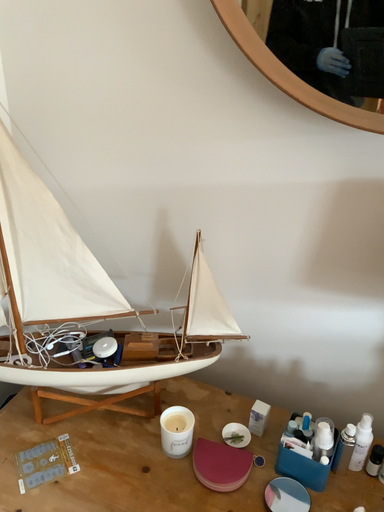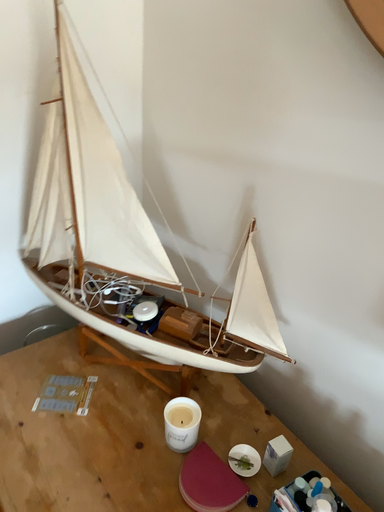
Question: How did the camera likely rotate when shooting the video?

Choices:
 (A) rotated left
 (B) rotated right

Answer: (A)